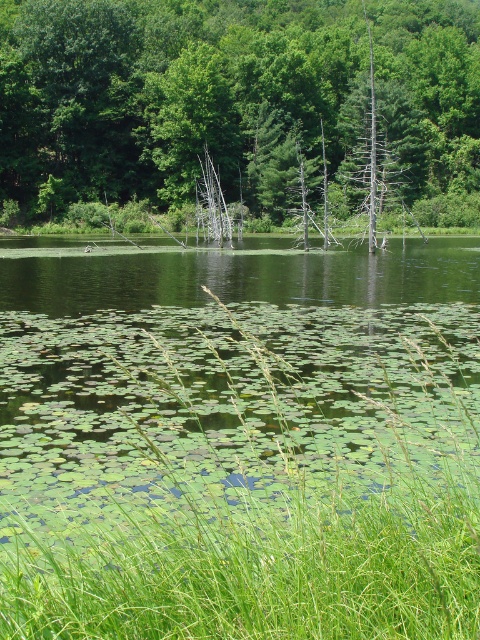
You are standing at the edge of the pond and notice the green grass at lower left and the green leafy tree at center. Which of these two objects appears narrower in the image?

The green grass at lower left has a lesser width compared to the green leafy tree at center, so it appears narrower.

You are standing at the edge of the pond and see the green grass at lower left and the green leafy tree at center. Which object is closer to your position?

The green grass at lower left is closer to your position because it is located below the green leafy tree at center, placing it nearer to the pond edge where you are standing.